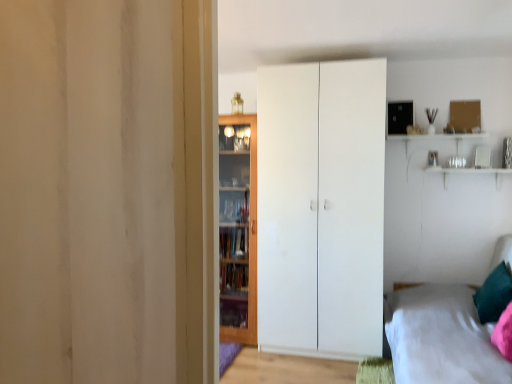
Locate an element on the screen. teal velvet pillow at lower right is located at coordinates (494, 294).

Choose the correct answer: Is white fabric bed at lower right inside wooden cabinet at center or outside it?

white fabric bed at lower right is spatially situated outside wooden cabinet at center.

Between white fabric bed at lower right and wooden cabinet at center, which one has smaller size?

wooden cabinet at center.

From the picture: Does white fabric bed at lower right have a greater height compared to wooden cabinet at center?

Incorrect, the height of white fabric bed at lower right is not larger of that of wooden cabinet at center.

Can you confirm if white fabric bed at lower right is wider than wooden cabinet at center?

Indeed, white fabric bed at lower right has a greater width compared to wooden cabinet at center.

Considering the sizes of white fabric bed at lower right and teal velvet pillow at lower right in the image, is white fabric bed at lower right wider or thinner than teal velvet pillow at lower right?

Considering their sizes, white fabric bed at lower right looks broader than teal velvet pillow at lower right.

From the image's perspective, which is above, white fabric bed at lower right or teal velvet pillow at lower right?

teal velvet pillow at lower right is shown above in the image.

Which is in front, point (458, 352) or point (482, 296)?

Point (458, 352)

From a real-world perspective, which is physically below, wooden cabinet at center or white matte wardrobe at center?

wooden cabinet at center is physically lower.

Can you confirm if wooden cabinet at center is positioned to the left of white matte wardrobe at center?

Yes.

From the image's perspective, is wooden cabinet at center below white matte wardrobe at center?

Correct, wooden cabinet at center appears lower than white matte wardrobe at center in the image.

Is wooden cabinet at center aimed at white matte wardrobe at center?

No, wooden cabinet at center is not turned towards white matte wardrobe at center.

I want to click on pillow on the right of white matte wardrobe at center, so click(494, 294).

From the image's perspective, is white matte wardrobe at center located above or below teal velvet pillow at lower right?

Based on their image positions, white matte wardrobe at center is located above teal velvet pillow at lower right.

Is teal velvet pillow at lower right at the back of white matte wardrobe at center?

No, white matte wardrobe at center is not facing the opposite direction of teal velvet pillow at lower right.

Are white matte wardrobe at center and teal velvet pillow at lower right located far from each other?

That's right, there is a large distance between white matte wardrobe at center and teal velvet pillow at lower right.

Would you say wooden cabinet at center is outside teal velvet pillow at lower right?

wooden cabinet at center lies outside teal velvet pillow at lower right's area.

Identify the location of pillow on the right side of wooden cabinet at center. (494, 294).

Is wooden cabinet at center to the right of teal velvet pillow at lower right from the viewer's perspective?

In fact, wooden cabinet at center is to the left of teal velvet pillow at lower right.

Is teal velvet pillow at lower right not within wooden cabinet at center?

Yes, teal velvet pillow at lower right is outside of wooden cabinet at center.

Could you tell me if teal velvet pillow at lower right is turned towards wooden cabinet at center?

Yes, teal velvet pillow at lower right faces towards wooden cabinet at center.

Considering the relative sizes of teal velvet pillow at lower right and wooden cabinet at center in the image provided, is teal velvet pillow at lower right smaller than wooden cabinet at center?

Yes.

Which of these two, white matte wardrobe at center or white fabric bed at lower right, stands taller?

Standing taller between the two is white matte wardrobe at center.

Locate an element on the screen. cupboard behind the white fabric bed at lower right is located at coordinates (321, 207).

Is white fabric bed at lower right inside white matte wardrobe at center?

No, white fabric bed at lower right is located outside of white matte wardrobe at center.

Who is smaller, white matte wardrobe at center or white fabric bed at lower right?

white matte wardrobe at center is smaller.

At what (x,y) coordinates should I click in order to perform the action: click on door located above the white fabric bed at lower right (from a real-world perspective). Please return your answer as a coordinate pair (x, y). The image size is (512, 384). Looking at the image, I should click on (238, 228).

Where is `bed on the left of teal velvet pillow at lower right`? This screenshot has width=512, height=384. bed on the left of teal velvet pillow at lower right is located at coordinates (441, 337).

Considering their positions, is white matte wardrobe at center positioned further to white fabric bed at lower right than teal velvet pillow at lower right?

Among the two, white matte wardrobe at center is located further to white fabric bed at lower right.

Based on the photo, considering their positions, is wooden cabinet at center positioned further to white fabric bed at lower right than white matte wardrobe at center?

wooden cabinet at center.

When comparing their distances from teal velvet pillow at lower right, does white matte wardrobe at center or wooden cabinet at center seem closer?

white matte wardrobe at center is closer to teal velvet pillow at lower right.

Estimate the real-world distances between objects in this image. Which object is further from teal velvet pillow at lower right, white fabric bed at lower right or white matte wardrobe at center?

Based on the image, white matte wardrobe at center appears to be further to teal velvet pillow at lower right.

Based on their spatial positions, is white fabric bed at lower right or teal velvet pillow at lower right further from wooden cabinet at center?

Based on the image, teal velvet pillow at lower right appears to be further to wooden cabinet at center.

Considering their positions, is wooden cabinet at center positioned further to teal velvet pillow at lower right than white matte wardrobe at center?

wooden cabinet at center is further to teal velvet pillow at lower right.

From the image, which object appears to be farther from teal velvet pillow at lower right, white matte wardrobe at center or white fabric bed at lower right?

white matte wardrobe at center.

When comparing their distances from white matte wardrobe at center, does teal velvet pillow at lower right or wooden cabinet at center seem further?

Among the two, teal velvet pillow at lower right is located further to white matte wardrobe at center.

This screenshot has width=512, height=384. In order to click on cupboard positioned between white fabric bed at lower right and wooden cabinet at center from near to far in this screenshot , I will do coord(321,207).

Identify the location of pillow between white fabric bed at lower right and wooden cabinet at center along the z-axis. (494, 294).

The image size is (512, 384). I want to click on cupboard located between wooden cabinet at center and teal velvet pillow at lower right in the left-right direction, so click(321, 207).

This screenshot has height=384, width=512. I want to click on pillow located between white fabric bed at lower right and white matte wardrobe at center in the depth direction, so click(494, 294).